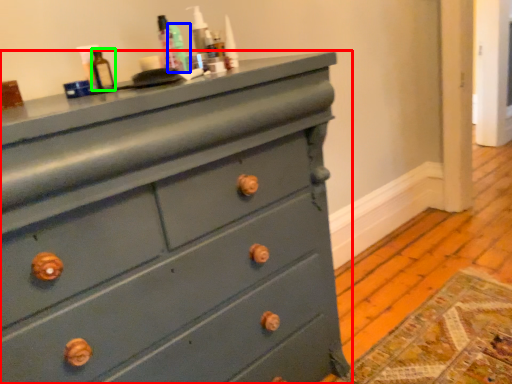
Question: Considering the real-world distances, which object is farthest from chest of drawers (highlighted by a red box)? teal (highlighted by a blue box) or bottle (highlighted by a green box)?

Choices:
 (A) teal
 (B) bottle

Answer: (B)